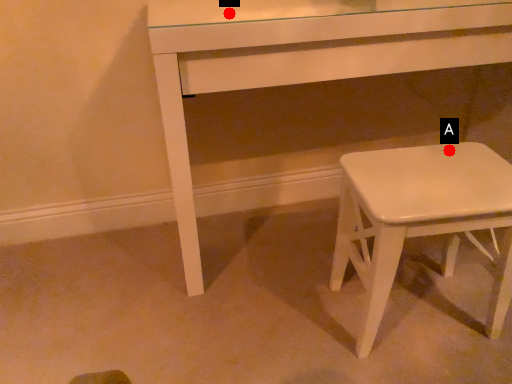
Question: Two points are circled on the image, labeled by A and B beside each circle. Which point appears farthest from the camera in this image?

Choices:
 (A) A is further
 (B) B is further

Answer: (A)